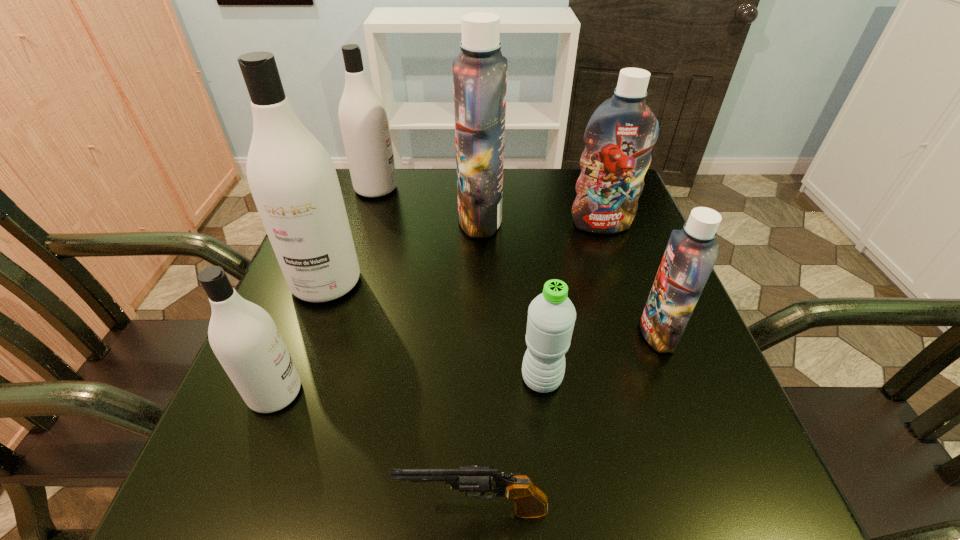
Identify the location of object that is at the far right corner. [x=619, y=137].

The height and width of the screenshot is (540, 960). In the image, there is a desktop. Find the location of `vacant space at the far edge`. vacant space at the far edge is located at coordinates (552, 178).

Locate an element on the screen. This screenshot has width=960, height=540. vacant space at the near edge of the desktop is located at coordinates (570, 515).

Where is `vacant space at the left edge of the desktop`? This screenshot has width=960, height=540. vacant space at the left edge of the desktop is located at coordinates (322, 307).

Locate an element on the screen. Image resolution: width=960 pixels, height=540 pixels. free spot at the right edge of the desktop is located at coordinates (608, 312).

This screenshot has height=540, width=960. I want to click on free space at the near left corner, so click(246, 496).

The height and width of the screenshot is (540, 960). Identify the location of vacant space at the near right corner. (696, 465).

Where is `empty space that is in between the fifth farthest object and the second biggest white shampoo`? This screenshot has width=960, height=540. empty space that is in between the fifth farthest object and the second biggest white shampoo is located at coordinates (517, 261).

I want to click on free spot between the third shampoo from right to left and the second biggest white shampoo, so click(x=428, y=204).

Where is `blank region between the shortest object and the farthest white shampoo`? blank region between the shortest object and the farthest white shampoo is located at coordinates (425, 349).